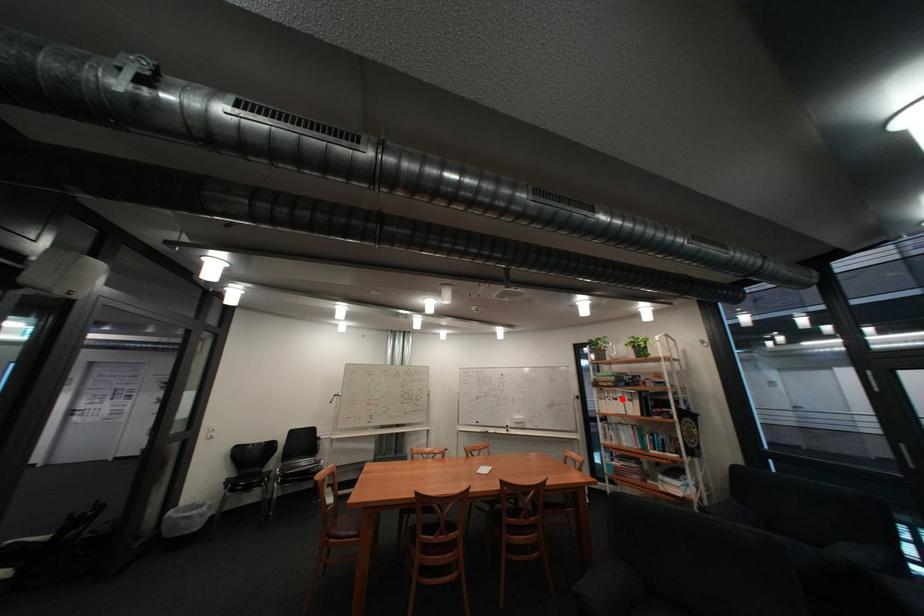
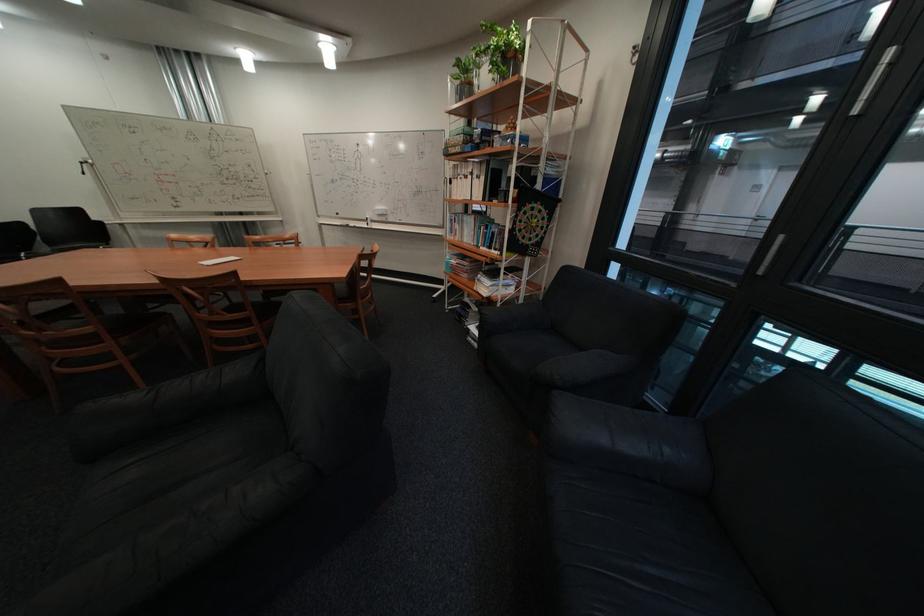
Locate, in the second image, the point that corresponds to the highlighted location in the first image.

(475, 177)